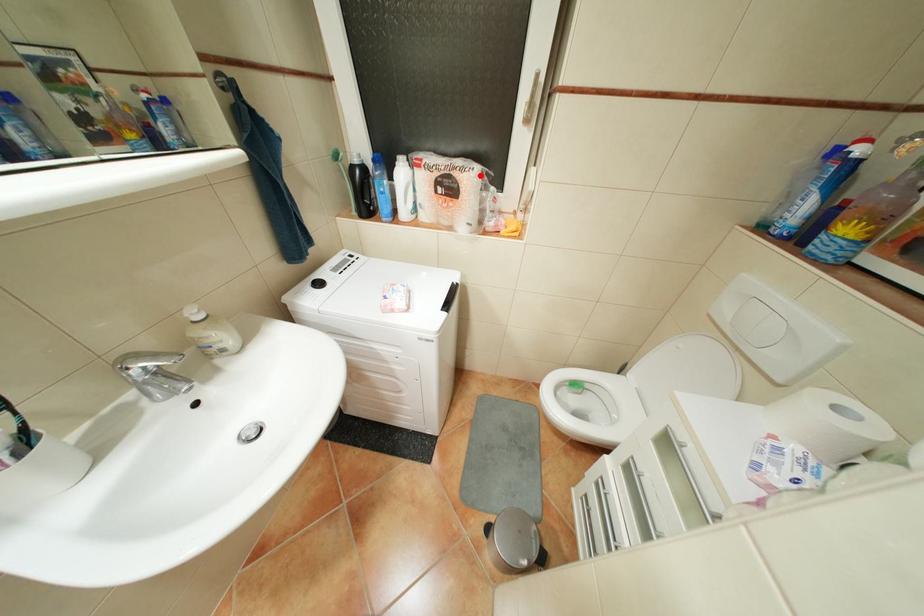
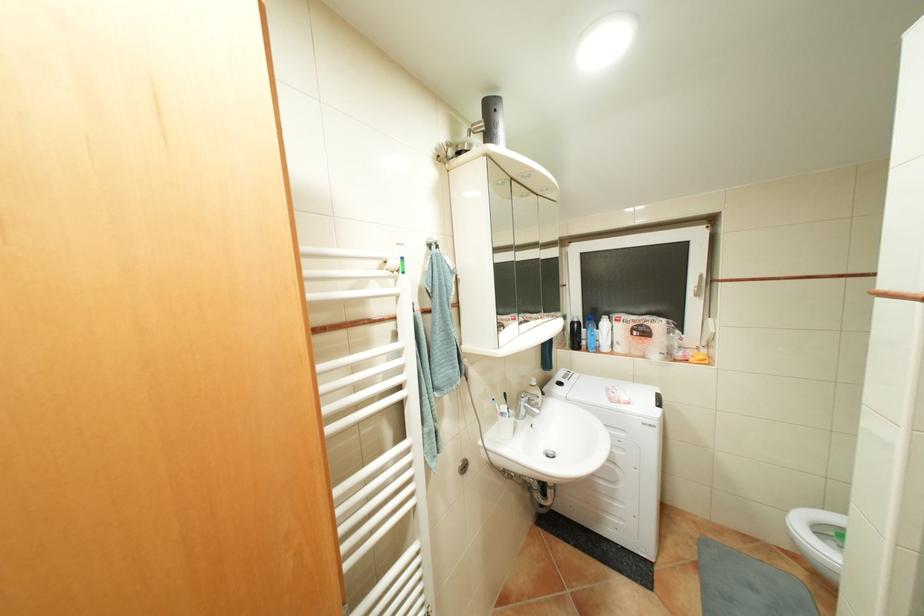
Find the pixel in the second image that matches the highlighted location in the first image.

(667, 323)